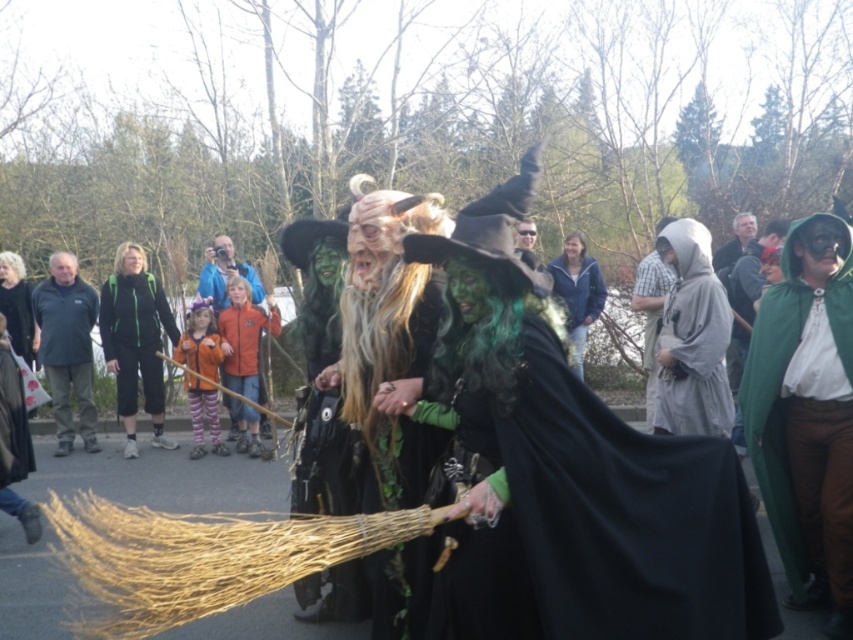
You are a photographer trying to capture the green fabric hood at center and the blue fabric jacket at center in a single shot. Which object should you focus on first to ensure both are in the frame?

The green fabric hood at center is in front of the blue fabric jacket at center, so you should focus on the green fabric hood at center first to ensure both are in the frame.

You are a costume designer observing the scene. You need to determine which fabric item, the green fabric hood at center or the blue fabric jacket at center, requires more material to make. Based on the description, which one would need more fabric?

The green fabric hood at center has a larger size compared to the blue fabric jacket at center, so it would require more fabric to make.

Consider the image. You are standing in the park and see the gray fabric hood at right. If you want to take a photo of it, where should you position yourself relative to the center of the image?

The gray fabric hood at right is located at the 2D coordinates point [692,339], so to take a photo of it, you should position yourself slightly to the right and lower portion of the image center.